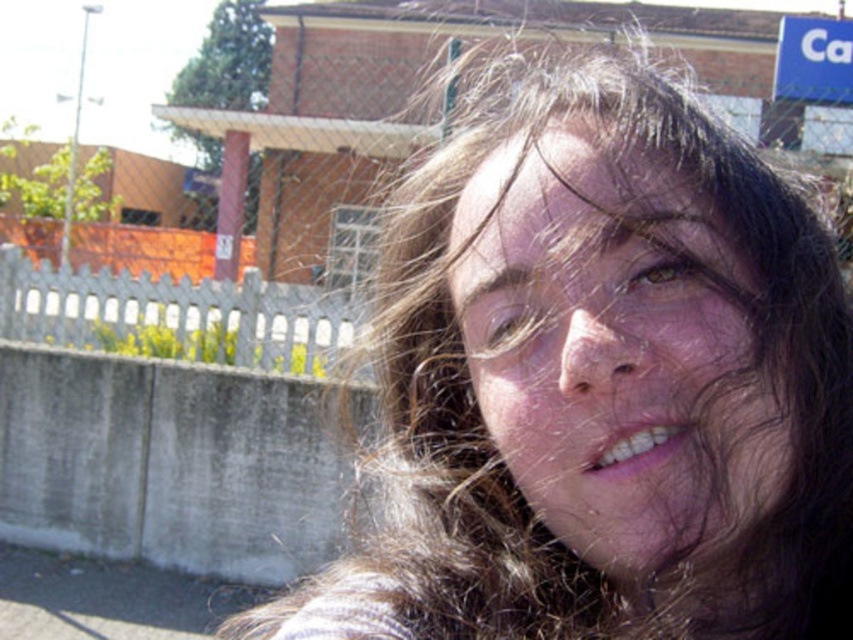
You are holding a 20 inch long measuring tape and want to measure the distance from your current position to the point at coordinates point (550,532). Can you reach it with your tape?

The point (550,532) is 22.18 inches away from camera. Since the measuring tape is only 20 inches long, you cannot reach it with your tape.

Please describe the exact location of the brown hair at center in the image using coordinates.

The brown hair at center is located at coordinates point (601, 381).

You are a photographer adjusting your camera settings. You notice the smooth skin face at center and the blue plastic sign at upper right in your viewfinder. Which object appears wider in the frame?

The blue plastic sign at upper right appears wider than the smooth skin face at center because the smooth skin face at center has a lesser width compared to blue plastic sign at upper right.